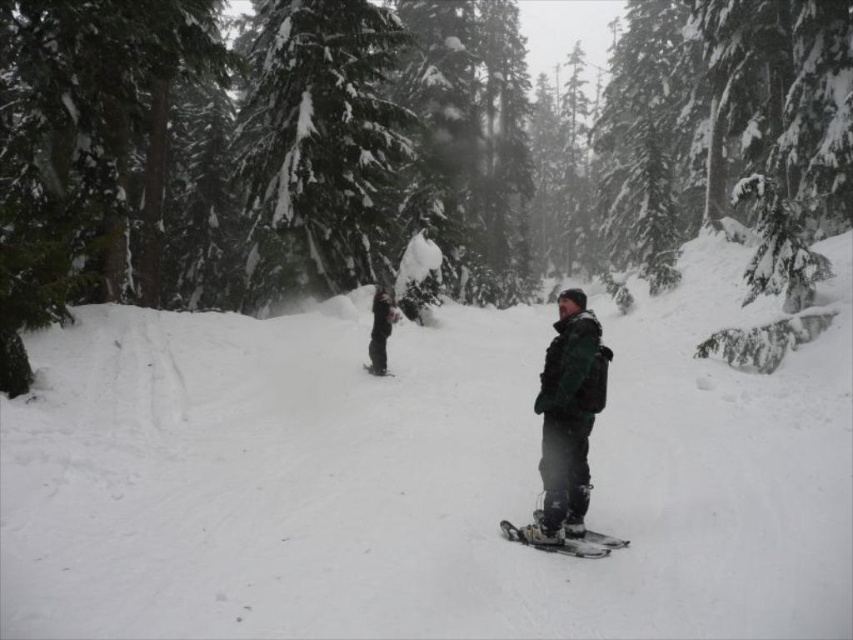
Identify the location of snow-covered evergreen at center. This screenshot has height=640, width=853. (320, 144).

Which is behind, point (256, 168) or point (387, 371)?

The point (256, 168) is more distant.

Does point (260, 93) lie in front of point (387, 372)?

No.

This screenshot has height=640, width=853. I want to click on snow-covered evergreen at center, so click(x=320, y=144).

Is green matte snowboarder at center positioned at the back of black matte snowboard at center?

No, green matte snowboarder at center is closer to the viewer.

Between green matte snowboarder at center and black matte snowboard at center, which one is positioned higher?

black matte snowboard at center

Which is in front, point (576, 300) or point (384, 371)?

Point (576, 300) is more forward.

At what (x,y) coordinates should I click in order to perform the action: click on green matte snowboarder at center. Please return your answer as a coordinate pair (x, y). Image resolution: width=853 pixels, height=640 pixels. Looking at the image, I should click on (569, 413).

Does white fluffy snow at center appear under black matte snowboard at center?

No.

How much distance is there between white fluffy snow at center and black matte snowboard at center?

14.87 feet

Measure the distance between point (91, 332) and camera.

51.11 feet

Locate an element on the screen. The height and width of the screenshot is (640, 853). white fluffy snow at center is located at coordinates (421, 477).